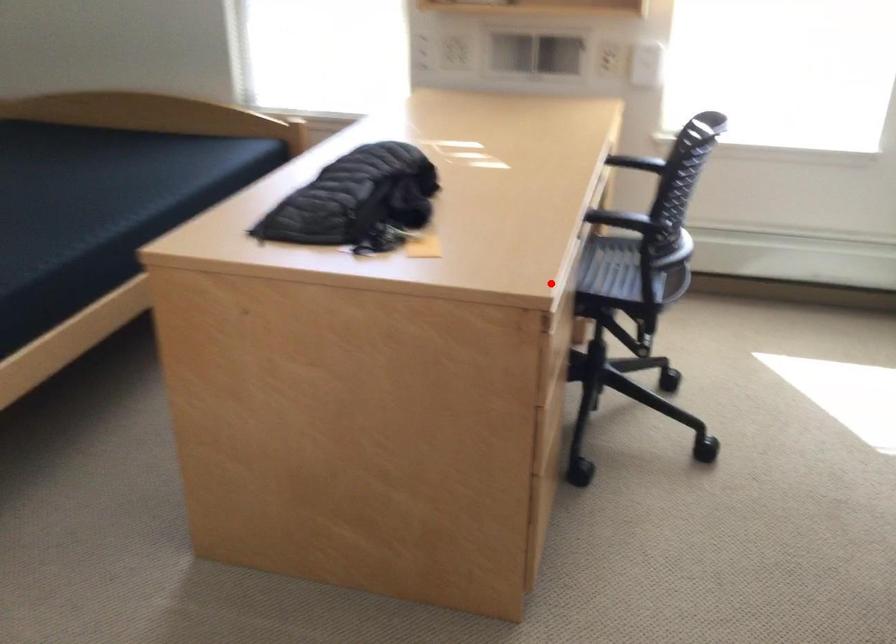
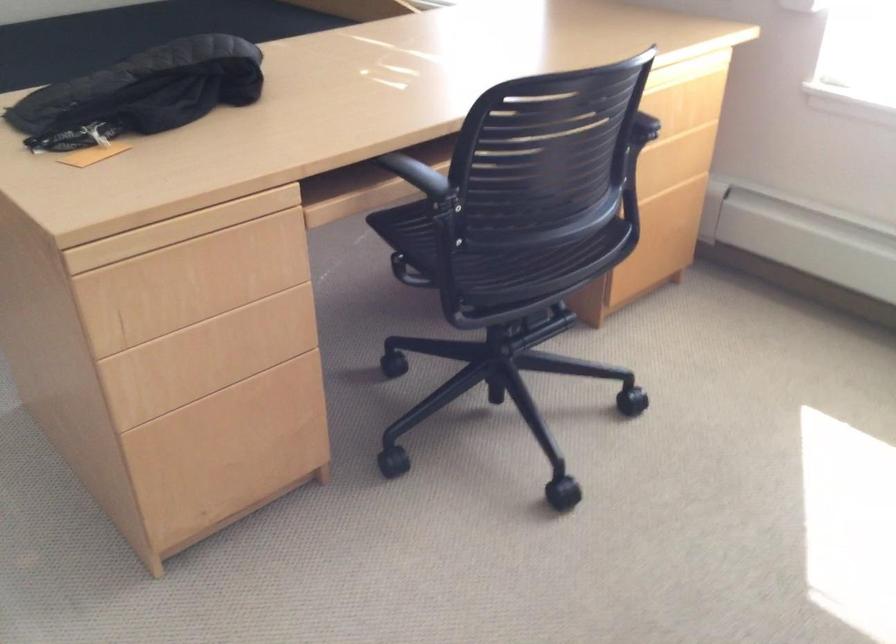
Question: A red point is marked in image1. In image2, is the corresponding 3D point closer to the camera or farther? Reply with the corresponding letter.

Choices:
 (A) The corresponding 3D point is closer.
 (B) The corresponding 3D point is farther.

Answer: (A)